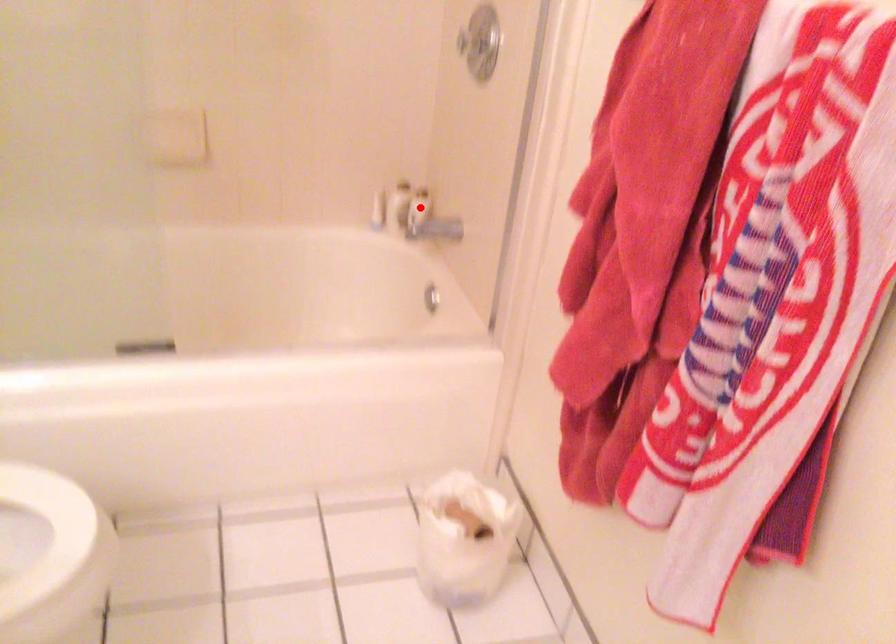
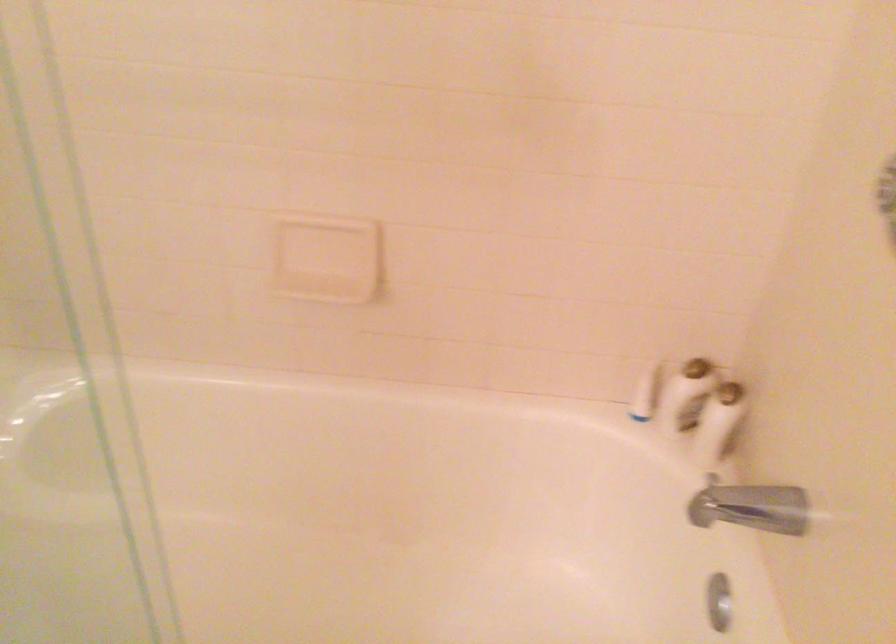
Question: I am providing you with two images of the same scene from different viewpoints. In image1, a red point is highlighted. Considering the same 3D point in image2, which of the following is correct?

Choices:
 (A) It is closer
 (B) It is farther

Answer: (A)